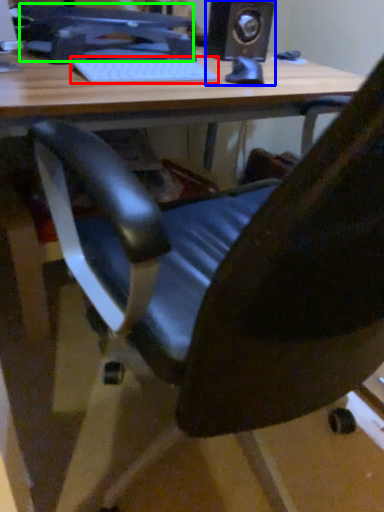
Question: Based on their relative distances, which object is farther from laptop keyboard (highlighted by a red box)? Choose from speaker (highlighted by a blue box) and computer monitor (highlighted by a green box).

Choices:
 (A) speaker
 (B) computer monitor

Answer: (A)